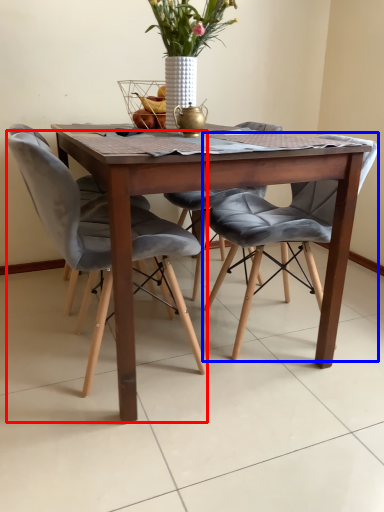
Question: Among these objects, which one is farthest to the camera, chair (highlighted by a red box) or chair (highlighted by a blue box)?

Choices:
 (A) chair
 (B) chair

Answer: (B)